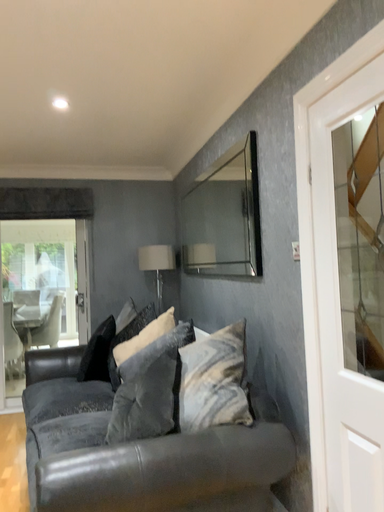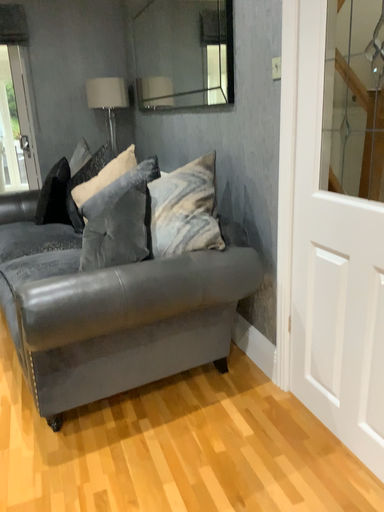
Question: Which way did the camera rotate in the video?

Choices:
 (A) rotated left
 (B) rotated right

Answer: (B)